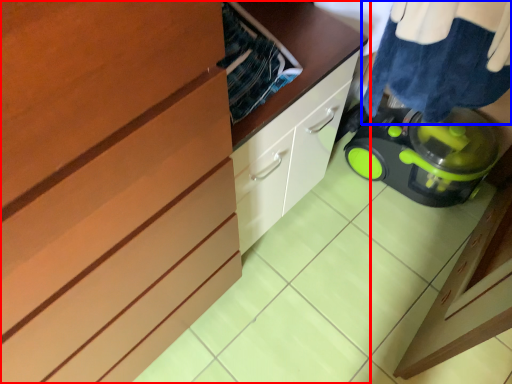
Question: Which object is closer to the camera taking this photo, cabinetry (highlighted by a red box) or laundry (highlighted by a blue box)?

Choices:
 (A) cabinetry
 (B) laundry

Answer: (B)